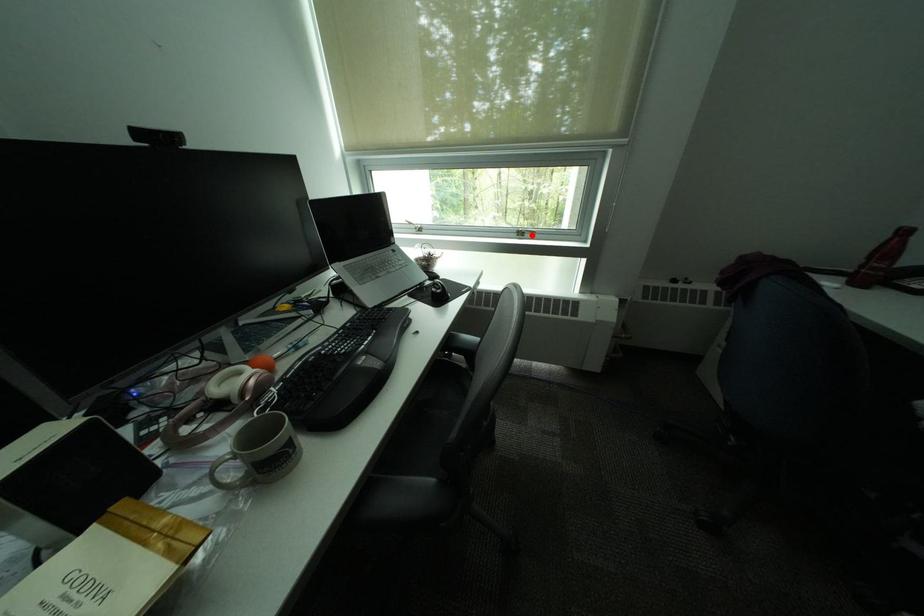
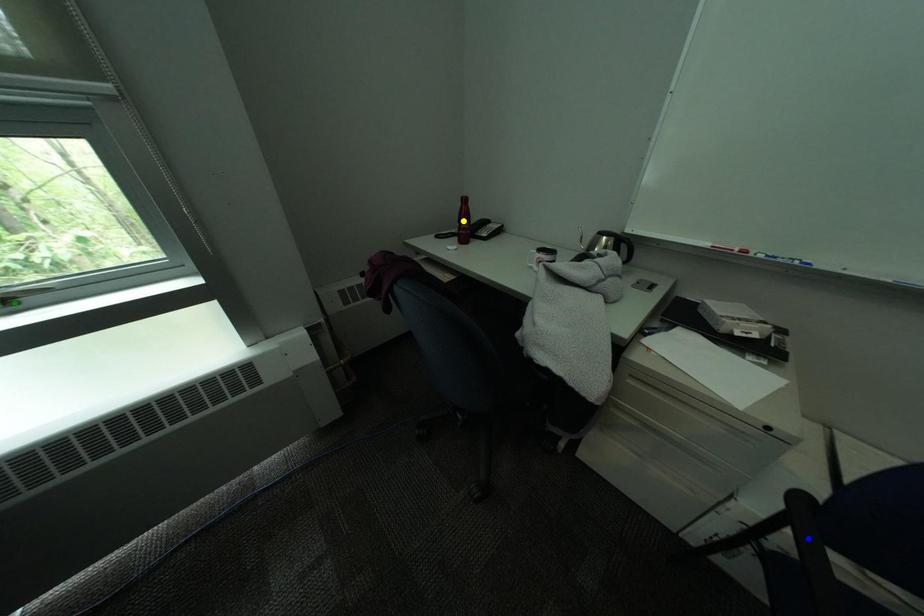
Question: I am providing you with two images of the same scene from different viewpoints. A red point is marked on the first image. You are given multiple points on the second image. Can you choose the point in image 2 that corresponds to the point in image 1?

Choices:
 (A) green point
 (B) yellow point
 (C) blue point

Answer: (A)